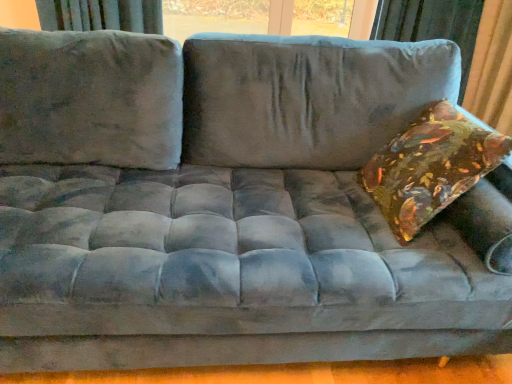
Question: From a real-world perspective, is velvet curtain at upper right under shiny metallic pillow at right?

Choices:
 (A) no
 (B) yes

Answer: (B)

Question: Is the depth of velvet curtain at upper right greater than that of shiny metallic pillow at right?

Choices:
 (A) no
 (B) yes

Answer: (B)

Question: Is velvet curtain at upper right oriented towards shiny metallic pillow at right?

Choices:
 (A) no
 (B) yes

Answer: (B)

Question: From the image's perspective, is velvet curtain at upper right over shiny metallic pillow at right?

Choices:
 (A) yes
 (B) no

Answer: (A)

Question: Is shiny metallic pillow at right located within velvet curtain at upper right?

Choices:
 (A) no
 (B) yes

Answer: (A)

Question: Is velvet curtain at upper right smaller than shiny metallic pillow at right?

Choices:
 (A) no
 (B) yes

Answer: (A)

Question: Considering the relative sizes of shiny metallic pillow at right and velvet curtain at upper right in the image provided, is shiny metallic pillow at right thinner than velvet curtain at upper right?

Choices:
 (A) yes
 (B) no

Answer: (A)

Question: Is shiny metallic pillow at right positioned beyond the bounds of velvet curtain at upper right?

Choices:
 (A) yes
 (B) no

Answer: (A)

Question: Does shiny metallic pillow at right lie behind velvet curtain at upper right?

Choices:
 (A) yes
 (B) no

Answer: (B)

Question: Is shiny metallic pillow at right smaller than velvet curtain at upper right?

Choices:
 (A) no
 (B) yes

Answer: (B)

Question: From the image's perspective, is shiny metallic pillow at right above velvet curtain at upper right?

Choices:
 (A) yes
 (B) no

Answer: (B)

Question: Can you confirm if shiny metallic pillow at right is wider than velvet curtain at upper right?

Choices:
 (A) no
 (B) yes

Answer: (A)

Question: Considering the relative positions of shiny metallic pillow at right and velvet curtain at upper right in the image provided, is shiny metallic pillow at right to the left or to the right of velvet curtain at upper right?

Choices:
 (A) right
 (B) left

Answer: (B)